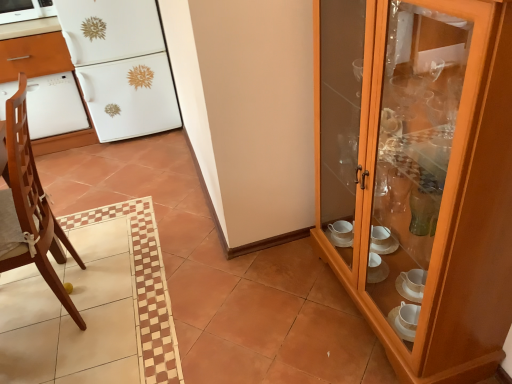
Question: From a real-world perspective, is white glossy oven at left positioned above or below brown wooden chair at left?

Choices:
 (A) below
 (B) above

Answer: (A)

Question: Is white glossy oven at left situated inside brown wooden chair at left or outside?

Choices:
 (A) inside
 (B) outside

Answer: (B)

Question: Estimate the real-world distances between objects in this image. Which object is farther from the white glossy refrigerator at upper left?

Choices:
 (A) white glossy oven at left
 (B) brown wooden chair at left
 (C) white glossy dishwasher at left
 (D) wooden cabinet at right
 (E) white glossy microwave at upper left

Answer: (D)

Question: Based on their relative distances, which object is farther from the white glossy oven at left?

Choices:
 (A) white glossy microwave at upper left
 (B) white glossy dishwasher at left
 (C) white glossy refrigerator at upper left
 (D) brown wooden chair at left
 (E) wooden cabinet at right

Answer: (E)